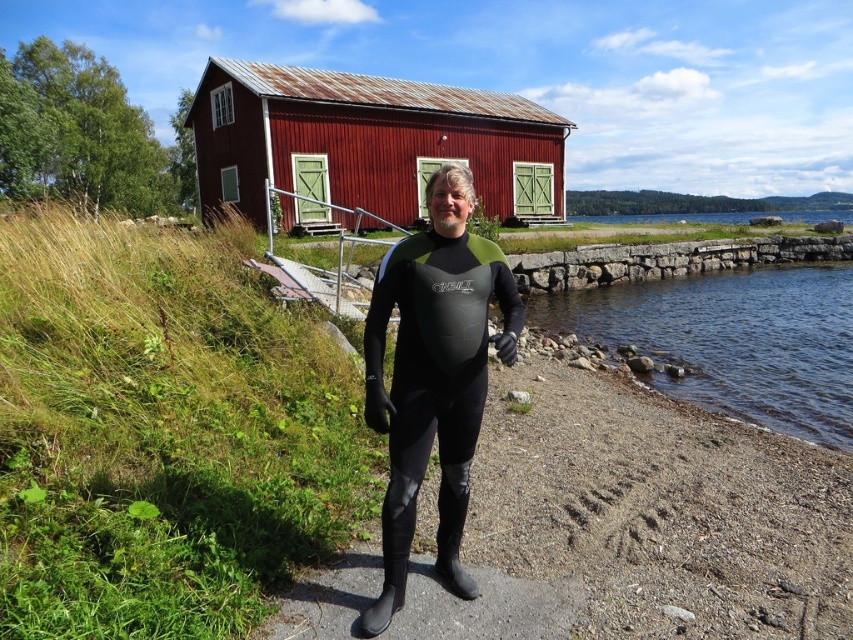
Question: Which object appears closest to the camera in this image?

Choices:
 (A) clear water at lower right
 (B) black neoprene wetsuit at center
 (C) rustic wood hut at center

Answer: (B)

Question: Considering the relative positions of rustic wood hut at center and clear water at lower right in the image provided, where is rustic wood hut at center located with respect to clear water at lower right?

Choices:
 (A) below
 (B) above

Answer: (B)

Question: Which point is closer to the camera?

Choices:
 (A) rustic wood hut at center
 (B) black neoprene wetsuit at center

Answer: (B)

Question: Can you confirm if black neoprene wetsuit at center is positioned above clear water at lower right?

Choices:
 (A) yes
 (B) no

Answer: (B)

Question: Estimate the real-world distances between objects in this image. Which object is closer to the rustic wood hut at center?

Choices:
 (A) black neoprene wetsuit at center
 (B) clear water at lower right

Answer: (B)

Question: Is black neoprene wetsuit at center above clear water at lower right?

Choices:
 (A) yes
 (B) no

Answer: (B)